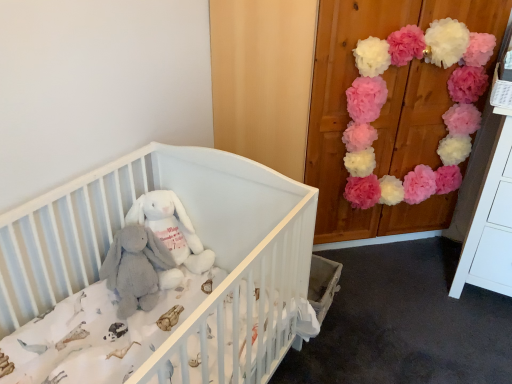
Question: Is white soft crib at center in front of white plush rabbit at center?

Choices:
 (A) no
 (B) yes

Answer: (B)

Question: From the image's perspective, is white soft crib at center located beneath white plush rabbit at center?

Choices:
 (A) yes
 (B) no

Answer: (A)

Question: Is white soft crib at center far away from white plush rabbit at center?

Choices:
 (A) no
 (B) yes

Answer: (A)

Question: Could you tell me if white soft crib at center is turned towards white plush rabbit at center?

Choices:
 (A) yes
 (B) no

Answer: (B)

Question: From a real-world perspective, does white soft crib at center sit lower than white plush rabbit at center?

Choices:
 (A) yes
 (B) no

Answer: (A)

Question: Visually, is white plush rabbit at center positioned to the left or to the right of gray plush elephant at center?

Choices:
 (A) left
 (B) right

Answer: (B)

Question: Is white plush rabbit at center in front of or behind gray plush elephant at center in the image?

Choices:
 (A) behind
 (B) front

Answer: (A)

Question: From the image's perspective, is white plush rabbit at center positioned above or below gray plush elephant at center?

Choices:
 (A) above
 (B) below

Answer: (A)

Question: Is white plush rabbit at center bigger or smaller than gray plush elephant at center?

Choices:
 (A) small
 (B) big

Answer: (A)

Question: Which is correct: gray plush elephant at center is inside white soft crib at center, or outside of it?

Choices:
 (A) inside
 (B) outside

Answer: (A)

Question: Considering the positions of gray plush elephant at center and white soft crib at center in the image, is gray plush elephant at center wider or thinner than white soft crib at center?

Choices:
 (A) wide
 (B) thin

Answer: (B)

Question: From a real-world perspective, is gray plush elephant at center above or below white soft crib at center?

Choices:
 (A) below
 (B) above

Answer: (B)

Question: Considering the positions of gray plush elephant at center and white soft crib at center in the image, is gray plush elephant at center taller or shorter than white soft crib at center?

Choices:
 (A) tall
 (B) short

Answer: (B)

Question: Looking at the image, does pink tissue paper pom-poms at upper right seem bigger or smaller compared to gray plush elephant at center?

Choices:
 (A) small
 (B) big

Answer: (B)

Question: Looking at their shapes, would you say pink tissue paper pom-poms at upper right is wider or thinner than gray plush elephant at center?

Choices:
 (A) thin
 (B) wide

Answer: (A)